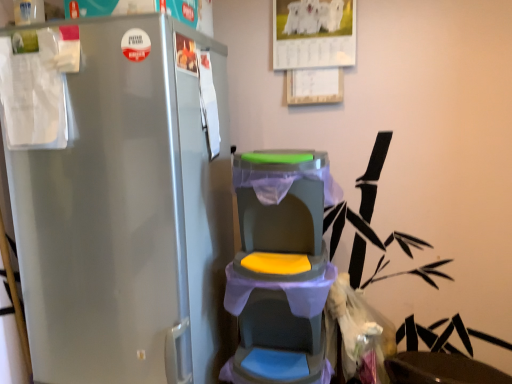
Question: Considering the positions of point (273, 324) and point (395, 370), is point (273, 324) closer or farther from the camera than point (395, 370)?

Choices:
 (A) farther
 (B) closer

Answer: (B)

Question: In terms of height, does matte plastic baby carriage at center look taller or shorter compared to matte black swivel chair at lower right?

Choices:
 (A) tall
 (B) short

Answer: (A)

Question: Is matte plastic baby carriage at center inside the boundaries of matte black swivel chair at lower right, or outside?

Choices:
 (A) inside
 (B) outside

Answer: (B)

Question: Looking at the image, does matte black swivel chair at lower right seem bigger or smaller compared to matte plastic baby carriage at center?

Choices:
 (A) small
 (B) big

Answer: (B)

Question: Relative to matte plastic baby carriage at center, is matte black swivel chair at lower right in front or behind?

Choices:
 (A) front
 (B) behind

Answer: (B)

Question: From the image's perspective, is matte black swivel chair at lower right located above or below matte plastic baby carriage at center?

Choices:
 (A) below
 (B) above

Answer: (A)

Question: Considering the positions of matte black swivel chair at lower right and matte plastic baby carriage at center in the image, is matte black swivel chair at lower right wider or thinner than matte plastic baby carriage at center?

Choices:
 (A) thin
 (B) wide

Answer: (B)